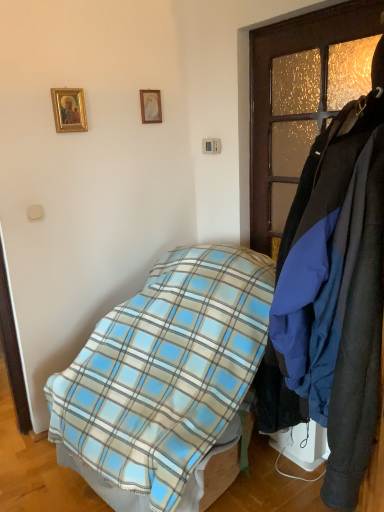
Question: Choose the correct answer: Is dark wood coat rack at right inside wooden picture frame at upper center, the first picture frame positioned from the back, or outside it?

Choices:
 (A) inside
 (B) outside

Answer: (B)

Question: From the image's perspective, is dark wood coat rack at right located above or below wooden picture frame at upper center, the 2th picture frame viewed from the left?

Choices:
 (A) below
 (B) above

Answer: (A)

Question: Considering the real-world distances, which object is farthest from the wooden picture frame at upper center, the first picture frame positioned from the back?

Choices:
 (A) dark wood coat rack at right
 (B) gold-framed picture at upper left, marked as the 2th picture frame in a right-to-left arrangement
 (C) blue plaid blanket at center

Answer: (C)

Question: Which object is the closest to the dark wood coat rack at right?

Choices:
 (A) wooden picture frame at upper center, the 2th picture frame viewed from the left
 (B) gold-framed picture at upper left, marked as the 2th picture frame in a right-to-left arrangement
 (C) blue plaid blanket at center

Answer: (A)